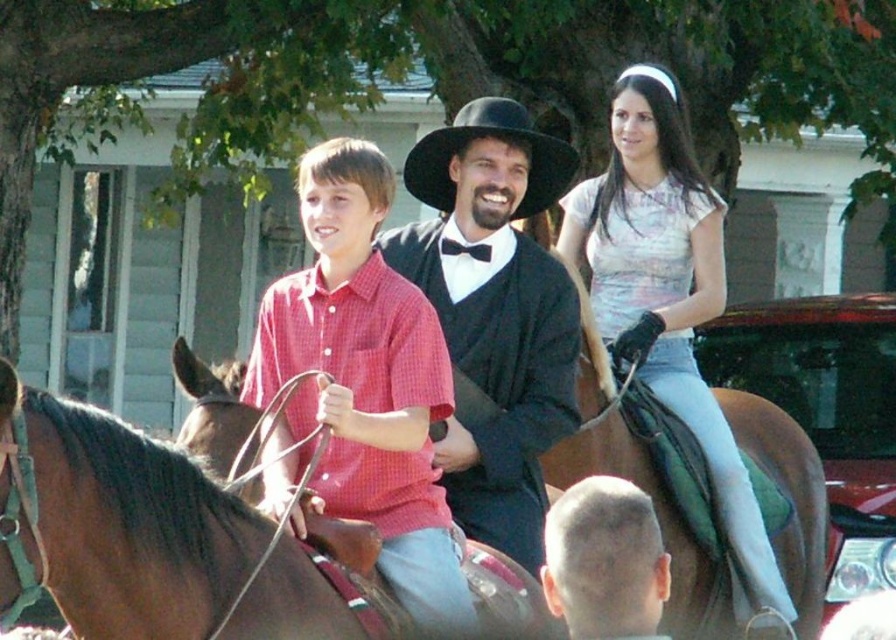
Question: Which object is farther from the camera taking this photo?

Choices:
 (A) matte black hat at center
 (B) light pink sheer blouse at upper right

Answer: (B)

Question: Can you confirm if light pink sheer blouse at upper right is positioned above black felt cowboy hat at center?

Choices:
 (A) yes
 (B) no

Answer: (B)

Question: Among these points, which one is farthest from the camera?

Choices:
 (A) (98, 557)
 (B) (643, 83)
 (C) (616, 593)
 (D) (448, 273)

Answer: (B)

Question: Which object appears farthest from the camera in this image?

Choices:
 (A) light pink sheer blouse at upper right
 (B) black felt cowboy hat at center

Answer: (A)

Question: Is the position of shaved head at center less distant than that of black felt cowboy hat at center?

Choices:
 (A) yes
 (B) no

Answer: (A)

Question: Considering the relative positions of red checkered shirt at center and shaved head at center in the image provided, where is red checkered shirt at center located with respect to shaved head at center?

Choices:
 (A) below
 (B) above

Answer: (B)